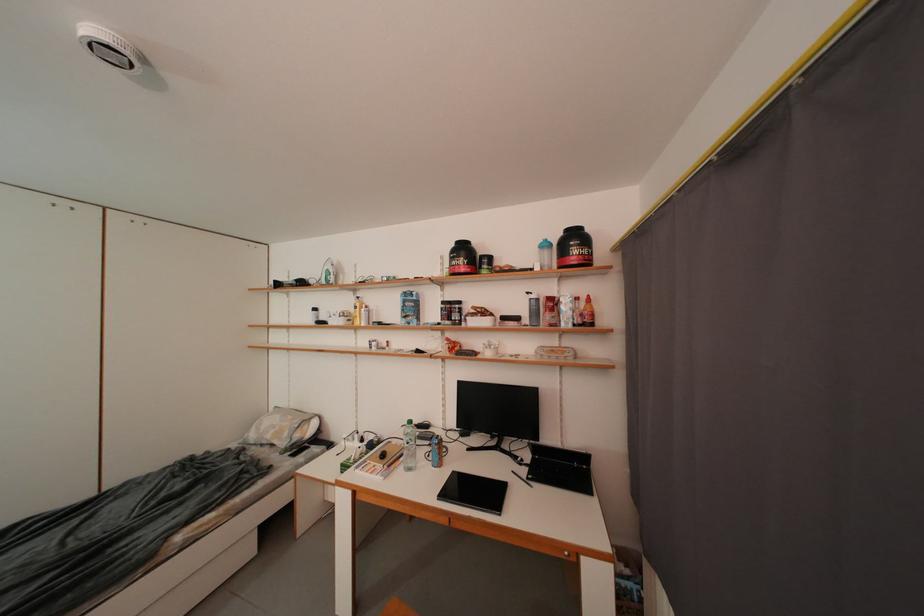
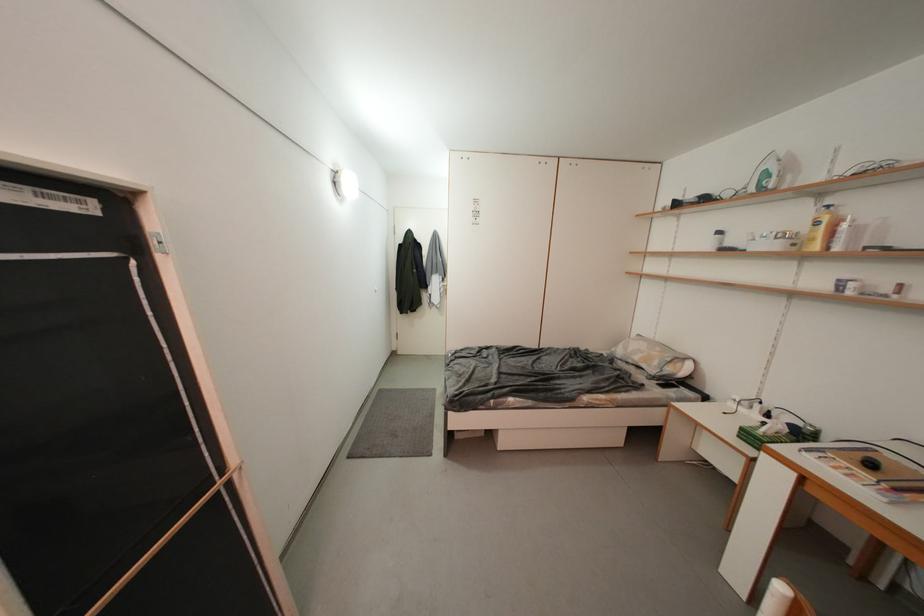
Question: The first image is from the beginning of the video and the second image is from the end. How did the camera likely rotate when shooting the video?

Choices:
 (A) Left
 (B) Right
 (C) Up
 (D) Down

Answer: (A)